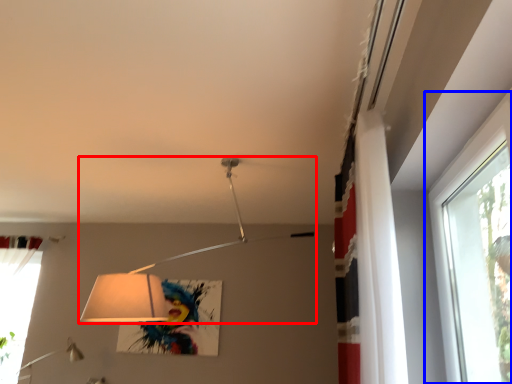
Question: Which point is closer to the camera, lamp (highlighted by a red box) or window (highlighted by a blue box)?

Choices:
 (A) lamp
 (B) window

Answer: (B)